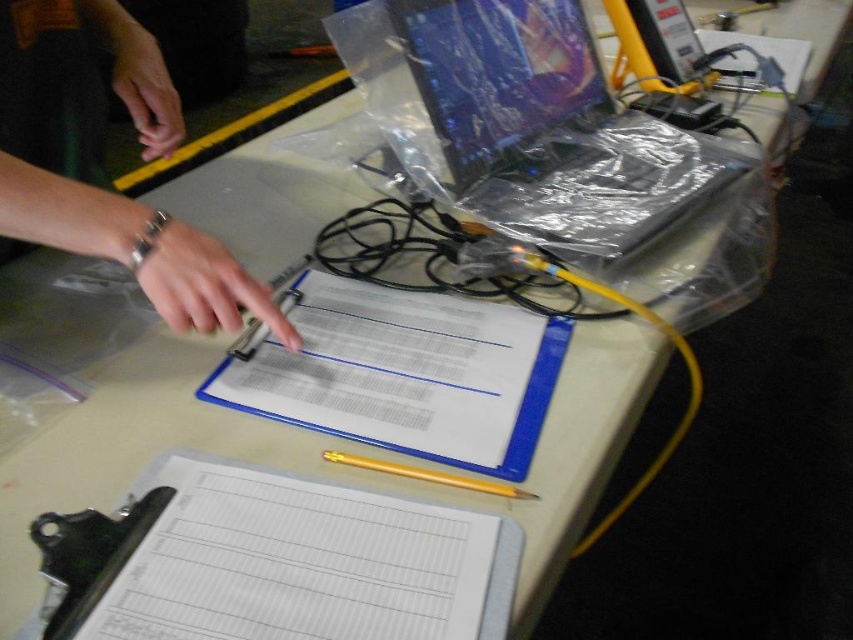
Question: Is white paper clipboard at center above yellow wood pencil at lower center?

Choices:
 (A) no
 (B) yes

Answer: (B)

Question: Which object is closer to the camera taking this photo?

Choices:
 (A) yellow wood pencil at lower center
 (B) skinny silver bracelet at upper left
 (C) white paper at lower left
 (D) clear plastic laptop at upper right

Answer: (C)

Question: Is white paper at lower left closer to camera compared to clear plastic laptop at upper right?

Choices:
 (A) no
 (B) yes

Answer: (B)

Question: Which object appears farthest from the camera in this image?

Choices:
 (A) skinny silver bracelet at upper left
 (B) yellow wood pencil at lower center
 (C) white paper at lower left
 (D) white paper clipboard at center

Answer: (A)

Question: Which point is farther from the camera taking this photo?

Choices:
 (A) (488, 488)
 (B) (460, 582)

Answer: (A)

Question: Does white paper at lower left have a greater width compared to yellow wood pencil at lower center?

Choices:
 (A) no
 (B) yes

Answer: (B)